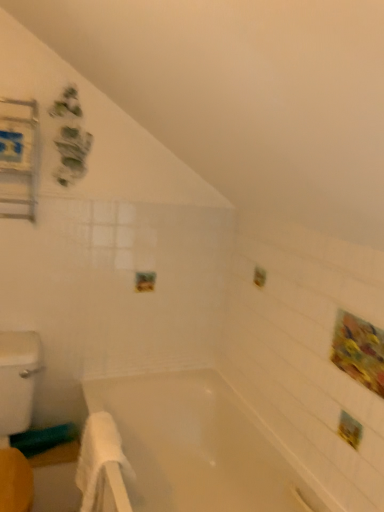
Where is `free space above white soft towel at lower left (from a real-world perspective)`? The width and height of the screenshot is (384, 512). free space above white soft towel at lower left (from a real-world perspective) is located at coordinates (101, 425).